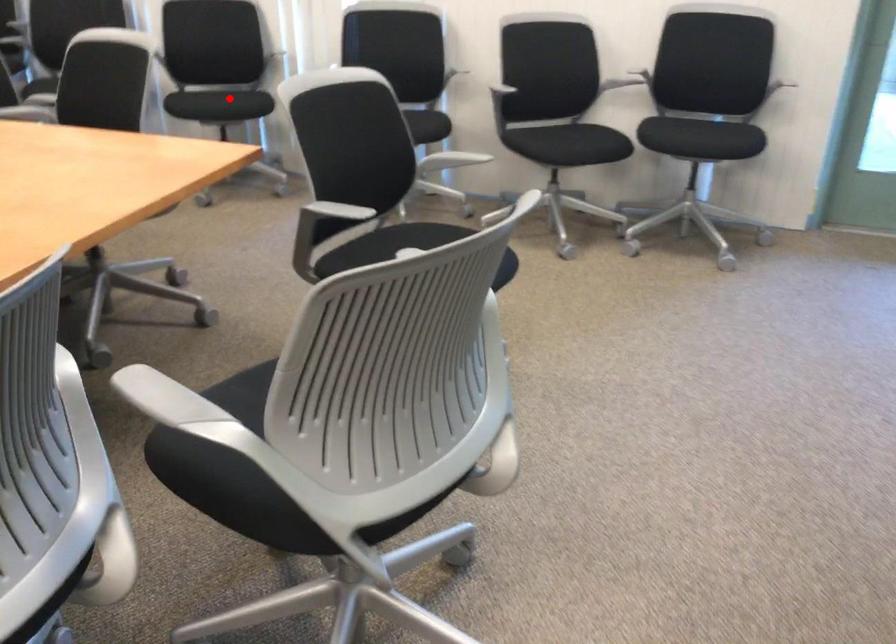
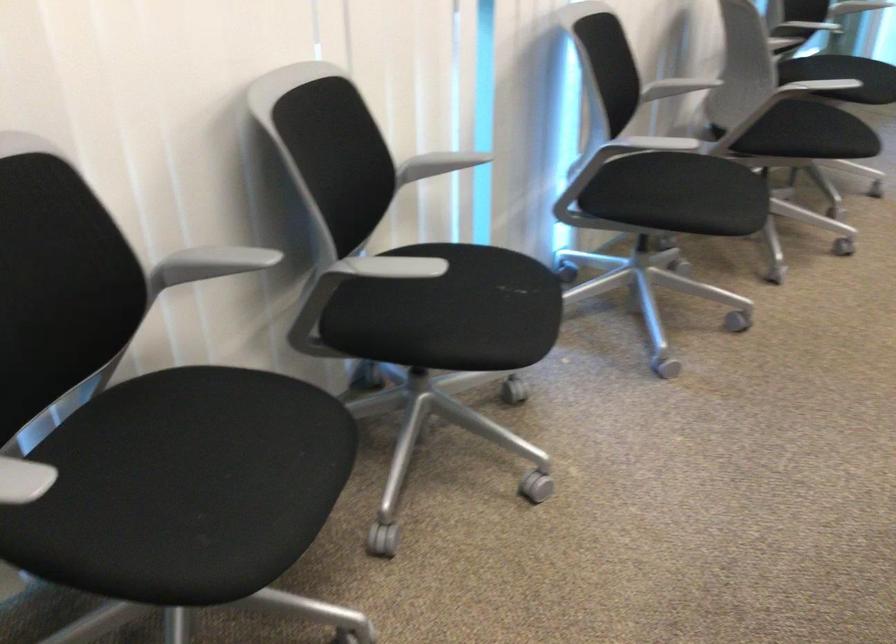
Question: I am providing you with two images of the same scene from different viewpoints. A red point is marked on the first image. Can you still see the location of the red point in image 2?

Choices:
 (A) Yes
 (B) No

Answer: (A)